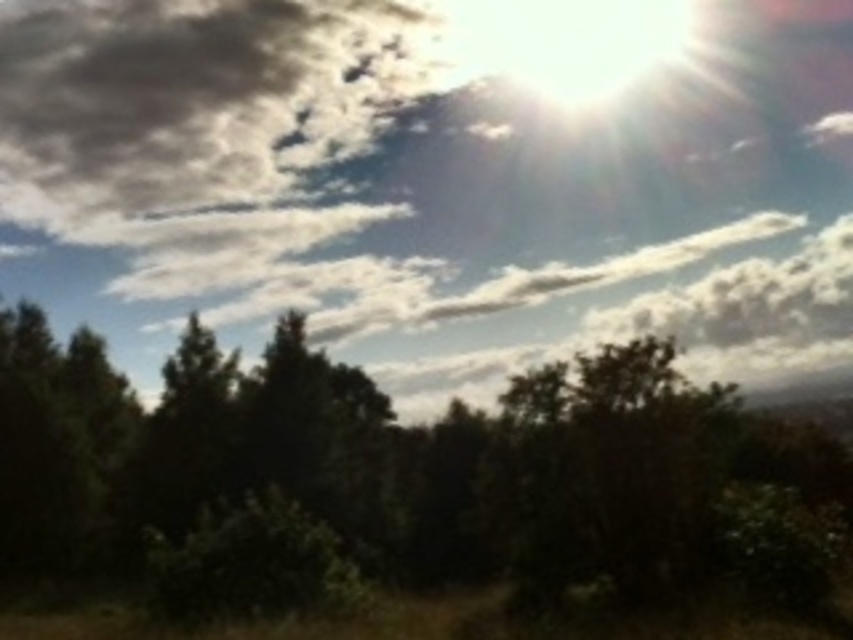
Between point (167, 461) and point (256, 148), which one is positioned behind?

The point (256, 148) is more distant.

Can you confirm if green leafy tree at center is positioned to the right of dark gray fluffy cloud at upper left?

Yes, green leafy tree at center is to the right of dark gray fluffy cloud at upper left.

Who is more forward, (206,392) or (166,20)?

Point (206,392)

I want to click on green leafy tree at center, so click(404, 477).

Does white fluffy cloud at upper center appear on the left side of dark gray fluffy cloud at upper left?

Incorrect, white fluffy cloud at upper center is not on the left side of dark gray fluffy cloud at upper left.

Does point (679, 360) come closer to viewer compared to point (123, 35)?

Yes, point (679, 360) is closer to viewer.

Between point (293, 246) and point (27, 58), which one is positioned in front?

Point (293, 246) is in front.

Identify the location of white fluffy cloud at upper center. [x=437, y=180].

Who is positioned more to the right, white fluffy cloud at upper center or green leafy tree at center?

white fluffy cloud at upper center is more to the right.

Who is shorter, white fluffy cloud at upper center or green leafy tree at center?

With less height is green leafy tree at center.

The height and width of the screenshot is (640, 853). Describe the element at coordinates (437, 180) in the screenshot. I see `white fluffy cloud at upper center` at that location.

Where is `white fluffy cloud at upper center`? white fluffy cloud at upper center is located at coordinates (437, 180).